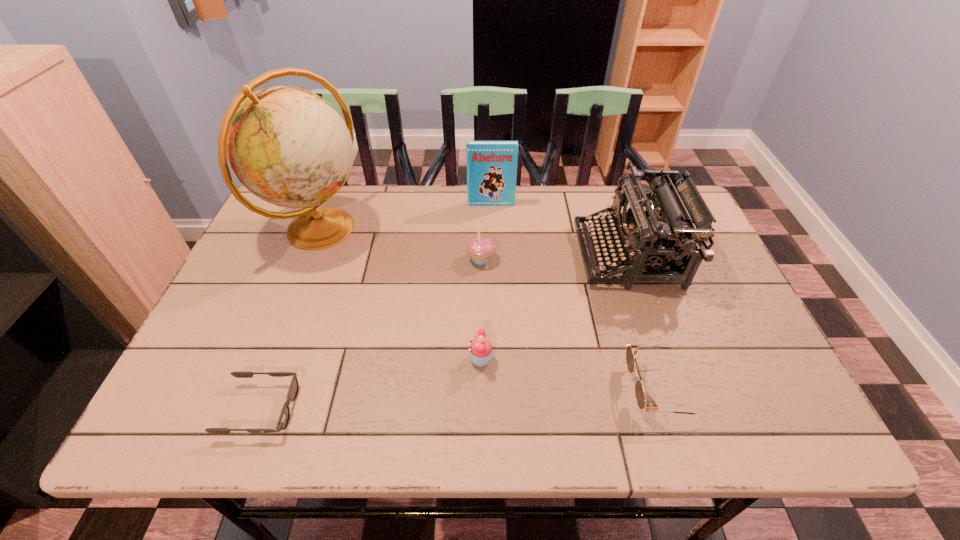
Find the location of `object present at the far right corner`. object present at the far right corner is located at coordinates (651, 238).

This screenshot has height=540, width=960. Identify the location of vacant point at the far edge. (456, 206).

The image size is (960, 540). I want to click on vacant space at the near edge, so click(480, 424).

You are a GUI agent. You are given a task and a screenshot of the screen. Output one action in this format:
    pyautogui.click(x=<x>, y=<y>)
    Task: Click on the vacant space at the left edge
    
    Given the screenshot: What is the action you would take?
    pyautogui.click(x=244, y=261)

Where is `vacant space at the right edge of the desktop`? The height and width of the screenshot is (540, 960). vacant space at the right edge of the desktop is located at coordinates (681, 322).

In the image, there is a desktop. Identify the location of vacant space at the near left corner. This screenshot has width=960, height=540. (x=175, y=434).

The image size is (960, 540). I want to click on free area in between the shorter sunglasses and the typewriter, so click(444, 332).

This screenshot has width=960, height=540. Find the location of `vacant space that is in between the shorter cupcake and the shortest object`. vacant space that is in between the shorter cupcake and the shortest object is located at coordinates (371, 384).

The image size is (960, 540). I want to click on unoccupied position between the right sunglasses and the typewriter, so click(x=644, y=322).

The width and height of the screenshot is (960, 540). Identify the location of blank region between the globe and the right sunglasses. (491, 309).